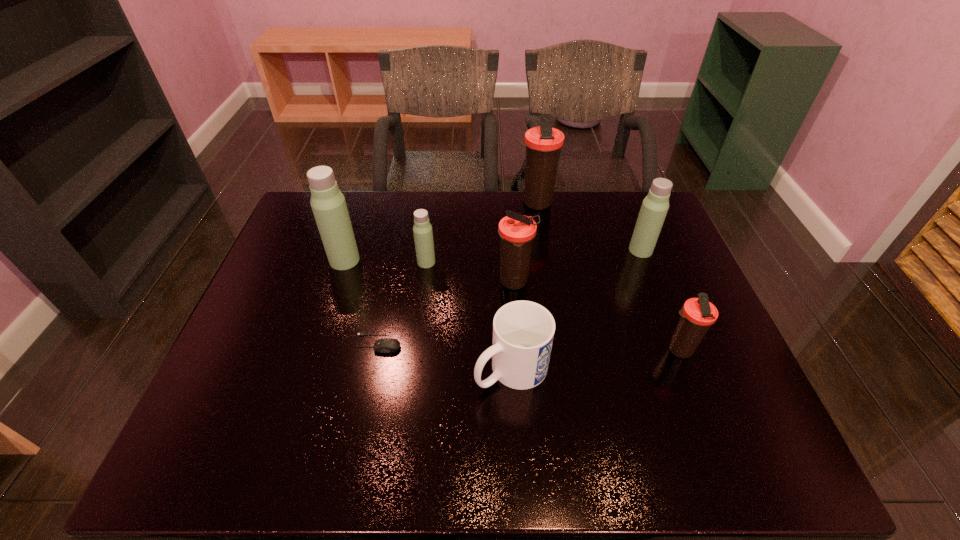
Locate an element on the screen. This screenshot has width=960, height=540. free spot between the second farthest brown thermos bottle and the leftmost object is located at coordinates (430, 272).

Where is `empty space that is in between the rightmost light thermos bottle and the shortest object`? The height and width of the screenshot is (540, 960). empty space that is in between the rightmost light thermos bottle and the shortest object is located at coordinates (510, 297).

Locate an element on the screen. The height and width of the screenshot is (540, 960). unoccupied position between the second biggest light thermos bottle and the rightmost brown thermos bottle is located at coordinates (660, 300).

In order to click on vacant space that's between the leftmost thermos bottle and the second smallest brown thermos bottle in this screenshot , I will do point(430,272).

In order to click on vacant point located between the second smallest brown thermos bottle and the leftmost light thermos bottle in this screenshot , I will do `click(430, 272)`.

At what (x,y) coordinates should I click in order to perform the action: click on free spot between the sixth object from right to left and the second nearest brown thermos bottle. Please return your answer as a coordinate pair (x, y). The image size is (960, 540). Looking at the image, I should click on (470, 272).

I want to click on unoccupied area between the fifth thermos bottle from right to left and the farthest object, so click(481, 233).

The image size is (960, 540). Find the location of `vacant space in between the leftmost object and the second light thermos bottle from left to right`. vacant space in between the leftmost object and the second light thermos bottle from left to right is located at coordinates (386, 261).

Identify which object is located as the nearest to the second farthest brown thermos bottle. Please provide its 2D coordinates. Your answer should be formatted as a tuple, i.e. [(x, y)], where the tuple contains the x and y coordinates of a point satisfying the conditions above.

[(523, 331)]

Select which object is the second closest to the farthest object. Please provide its 2D coordinates. Your answer should be formatted as a tuple, i.e. [(x, y)], where the tuple contains the x and y coordinates of a point satisfying the conditions above.

[(517, 231)]